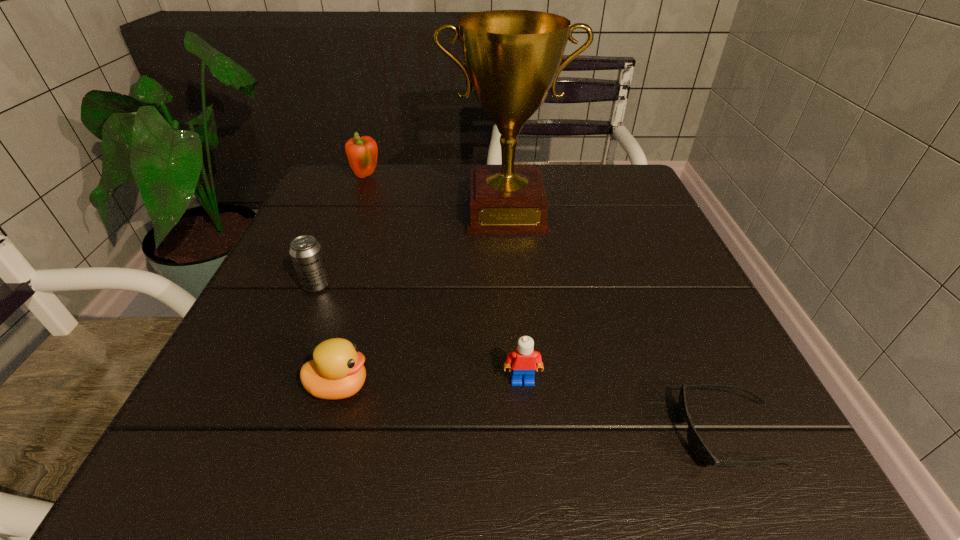
Choose which object is the fourth nearest neighbor to the duckling. Please provide its 2D coordinates. Your answer should be formatted as a tuple, i.e. [(x, y)], where the tuple contains the x and y coordinates of a point satisfying the conditions above.

[(701, 452)]

The image size is (960, 540). In order to click on object that is the fifth closest to the duckling in this screenshot , I will do `click(362, 152)`.

At what (x,y) coordinates should I click in order to perform the action: click on free location that satisfies the following two spatial constraints: 1. on the plaque of the second farthest object; 2. on the face of the duckling. Please return your answer as a coordinate pair (x, y). Looking at the image, I should click on (519, 387).